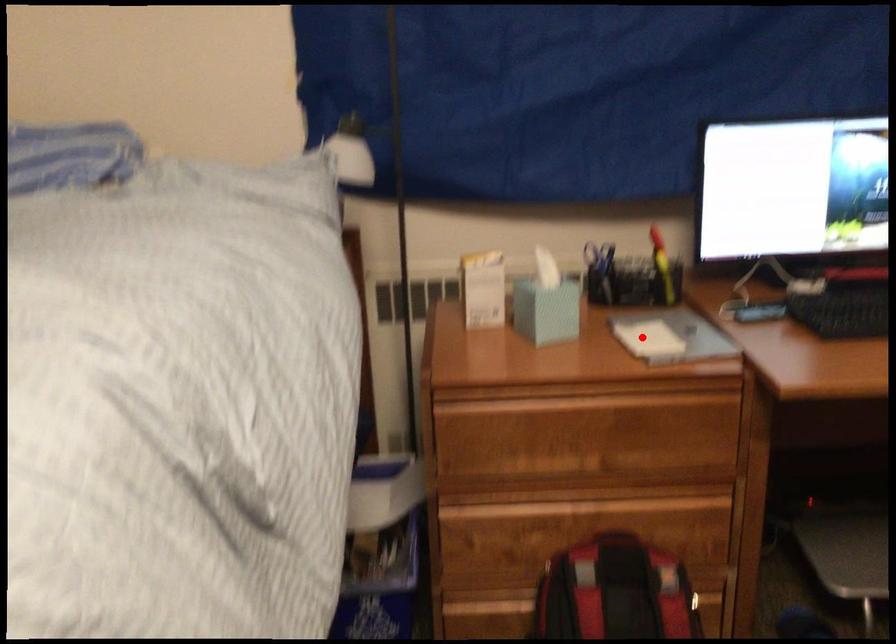
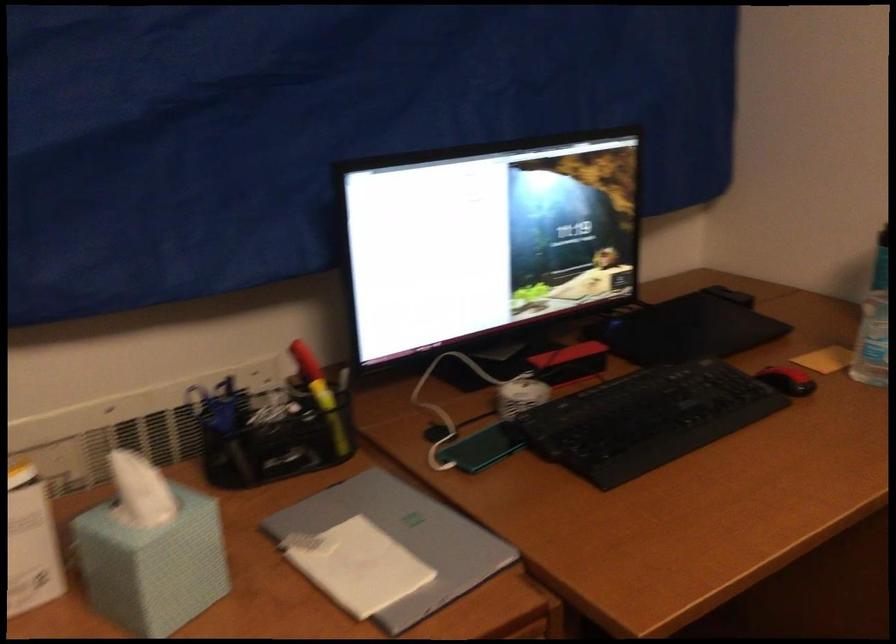
The point at the highlighted location is marked in the first image. Where is the corresponding point in the second image?

(357, 565)